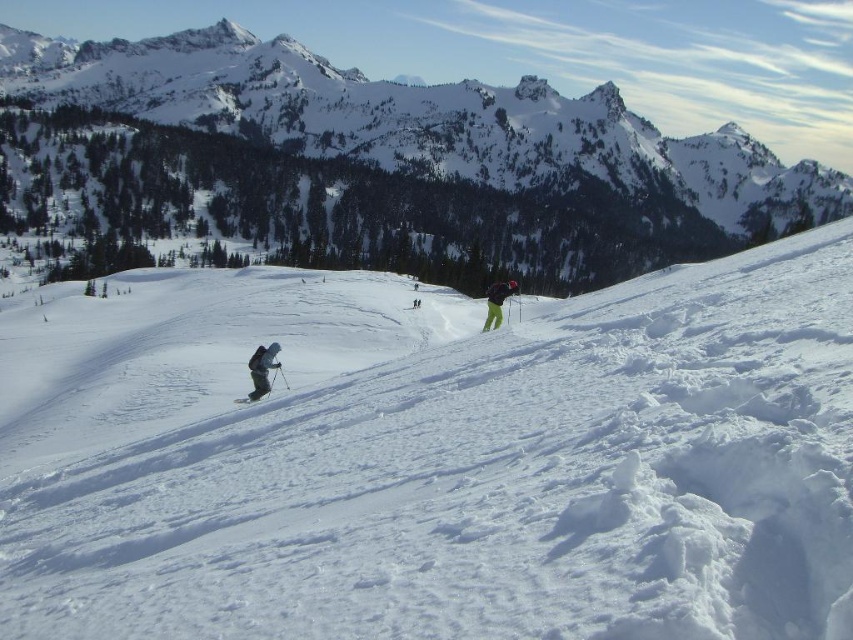
Question: Is white powdery snow at center wider than green matte pants at center?

Choices:
 (A) no
 (B) yes

Answer: (B)

Question: Which point appears closest to the camera in this image?

Choices:
 (A) [579, 122]
 (B) [503, 285]

Answer: (B)

Question: Among these points, which one is nearest to the camera?

Choices:
 (A) (505, 289)
 (B) (254, 388)
 (C) (273, 362)
 (D) (126, 387)

Answer: (C)

Question: Considering the relative positions of snowy mountain at upper center and dark gray ski suit at lower left in the image provided, where is snowy mountain at upper center located with respect to dark gray ski suit at lower left?

Choices:
 (A) right
 (B) left

Answer: (B)

Question: Is dark gray ski suit at lower left to the left of white matte ski at lower left from the viewer's perspective?

Choices:
 (A) yes
 (B) no

Answer: (A)

Question: Estimate the real-world distances between objects in this image. Which object is farther from the white matte ski at lower left?

Choices:
 (A) dark gray ski suit at lower left
 (B) white powdery snow at center
 (C) green matte pants at center

Answer: (B)